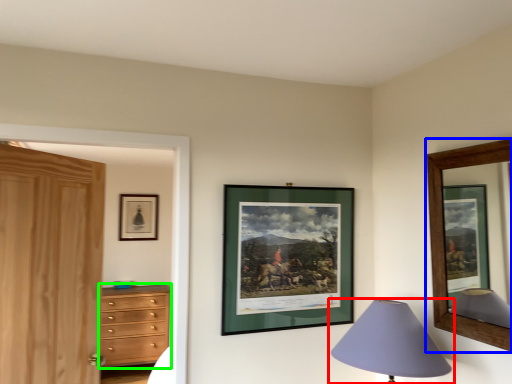
Question: Considering the real-world distances, which object is farthest from lamp (highlighted by a red box)? picture frame (highlighted by a blue box) or chest of drawers (highlighted by a green box)?

Choices:
 (A) picture frame
 (B) chest of drawers

Answer: (B)